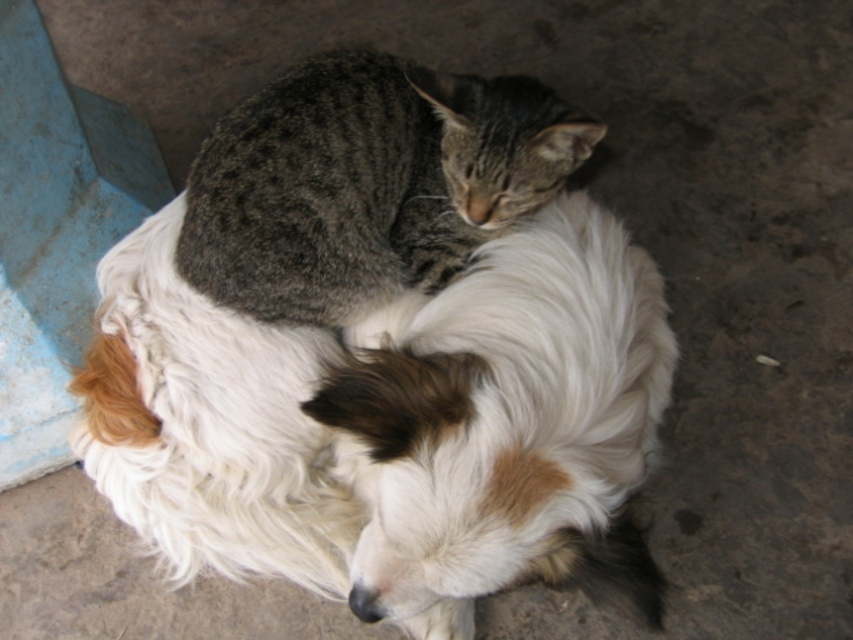
Question: Where is white fluffy dog at center located in relation to gray tabby cat at center in the image?

Choices:
 (A) left
 (B) right

Answer: (A)

Question: Among these points, which one is farthest from the camera?

Choices:
 (A) pyautogui.click(x=250, y=204)
 (B) pyautogui.click(x=561, y=496)

Answer: (A)

Question: Which point is farther to the camera?

Choices:
 (A) gray tabby cat at center
 (B) white fluffy dog at center

Answer: (A)

Question: From the image, what is the correct spatial relationship of white fluffy dog at center in relation to gray tabby cat at center?

Choices:
 (A) below
 (B) above

Answer: (A)

Question: Can you confirm if white fluffy dog at center is bigger than gray tabby cat at center?

Choices:
 (A) yes
 (B) no

Answer: (A)